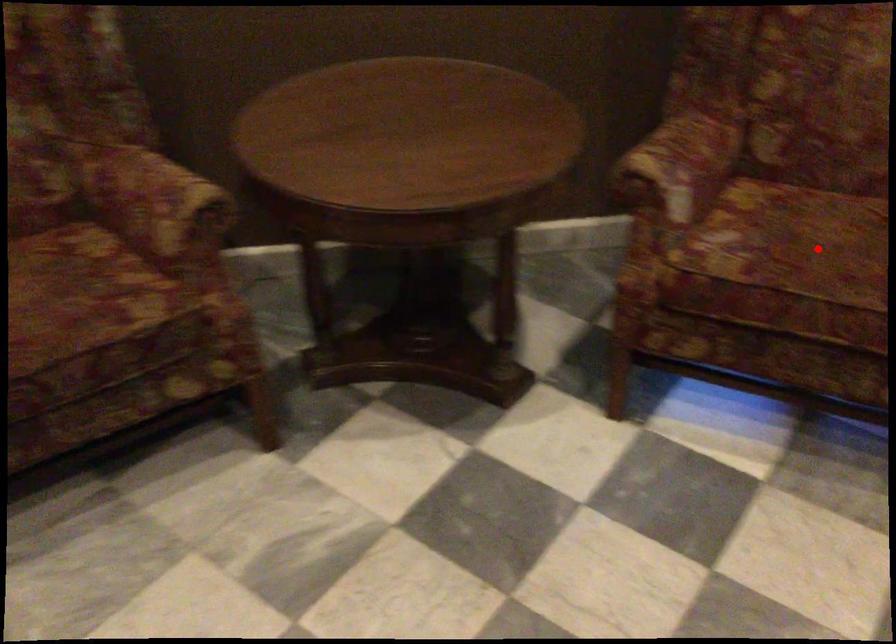
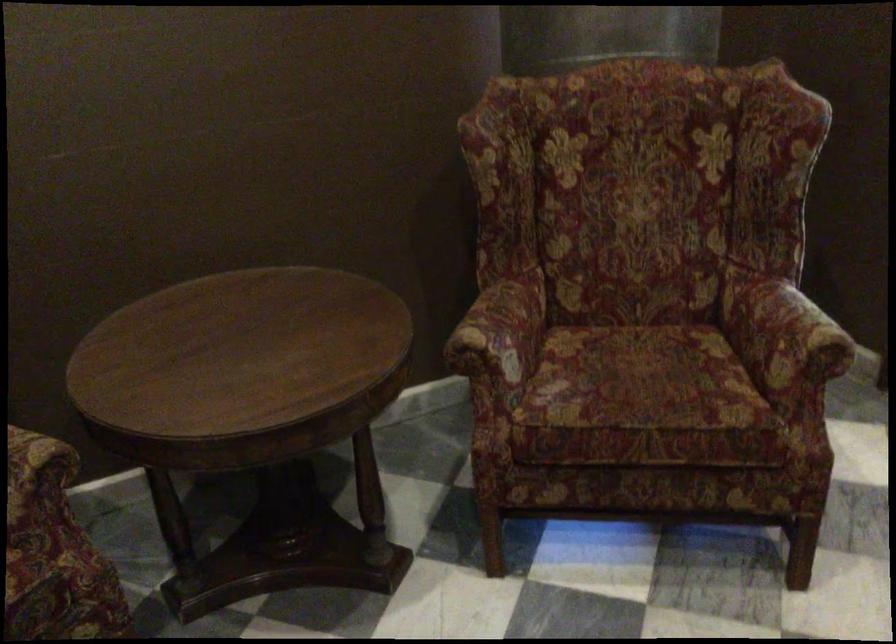
Question: I am providing you with two images of the same scene from different viewpoints. A red point is marked on the first image. Can you still see the location of the red point in image 2?

Choices:
 (A) Yes
 (B) No

Answer: (A)